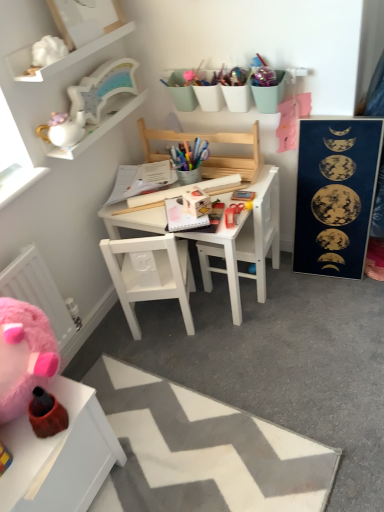
Where is `vacant area in front of white wooden table at center, which is counted as the 1th table, starting from the back`? vacant area in front of white wooden table at center, which is counted as the 1th table, starting from the back is located at coordinates (244, 355).